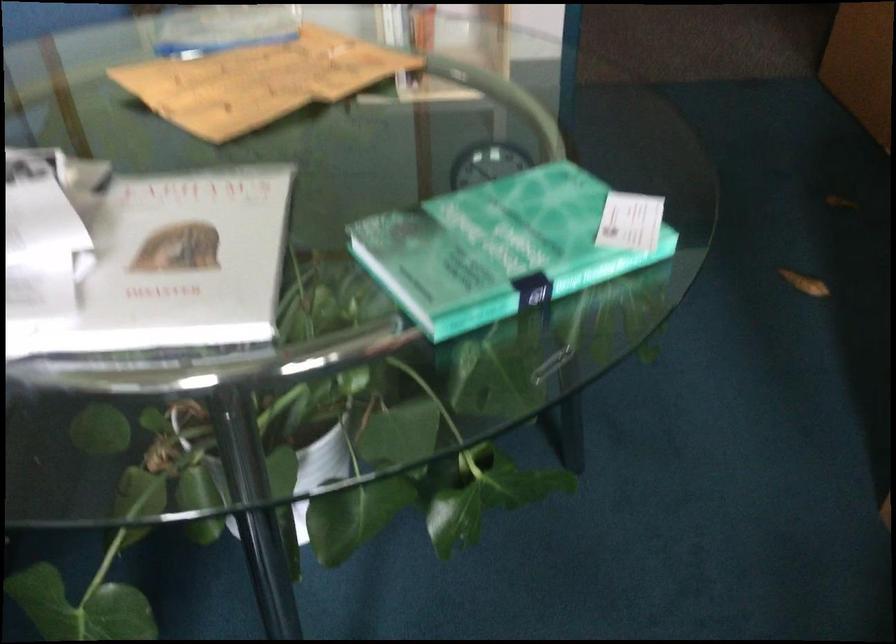
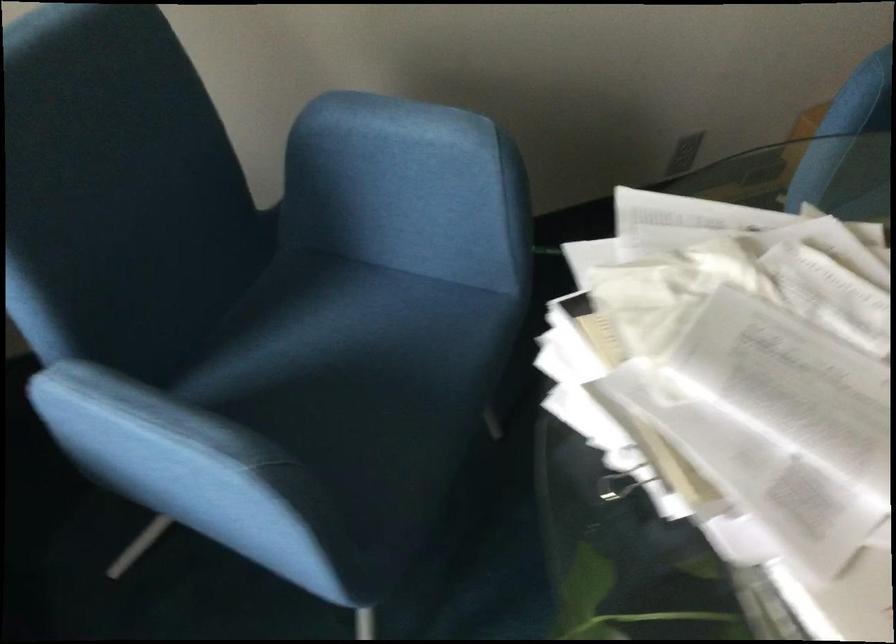
How did the camera likely rotate?

The camera's rotation is toward left-down.